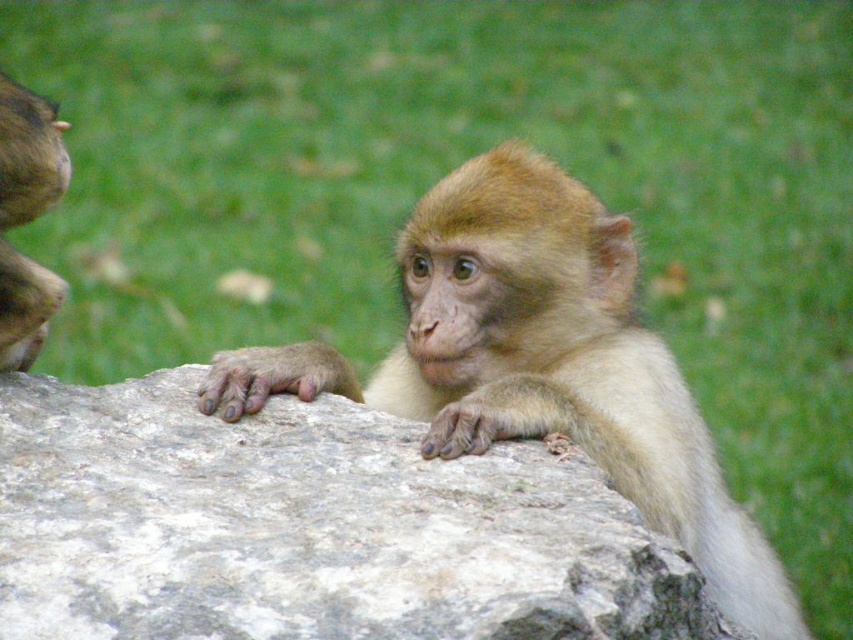
Which is above, gray rough rock at center or fuzzy brown monkey at center?

Positioned higher is fuzzy brown monkey at center.

Is point (334, 620) positioned before point (375, 385)?

Yes.

Who is more distant from viewer, (178,467) or (782,577)?

The point (782,577) is more distant.

The image size is (853, 640). What are the coordinates of `gray rough rock at center` in the screenshot? It's located at (308, 528).

Is gray rough rock at center to the left of golden fur monkey at left from the viewer's perspective?

Incorrect, gray rough rock at center is not on the left side of golden fur monkey at left.

Can you confirm if gray rough rock at center is bigger than golden fur monkey at left?

Yes.

In order to click on gray rough rock at center in this screenshot , I will do `click(308, 528)`.

Is fuzzy brown monkey at center thinner than golden fur monkey at left?

Incorrect, fuzzy brown monkey at center's width is not less than golden fur monkey at left's.

Is point (491, 401) positioned before point (10, 328)?

That is False.

Find the location of a particular element. This screenshot has height=640, width=853. fuzzy brown monkey at center is located at coordinates (538, 364).